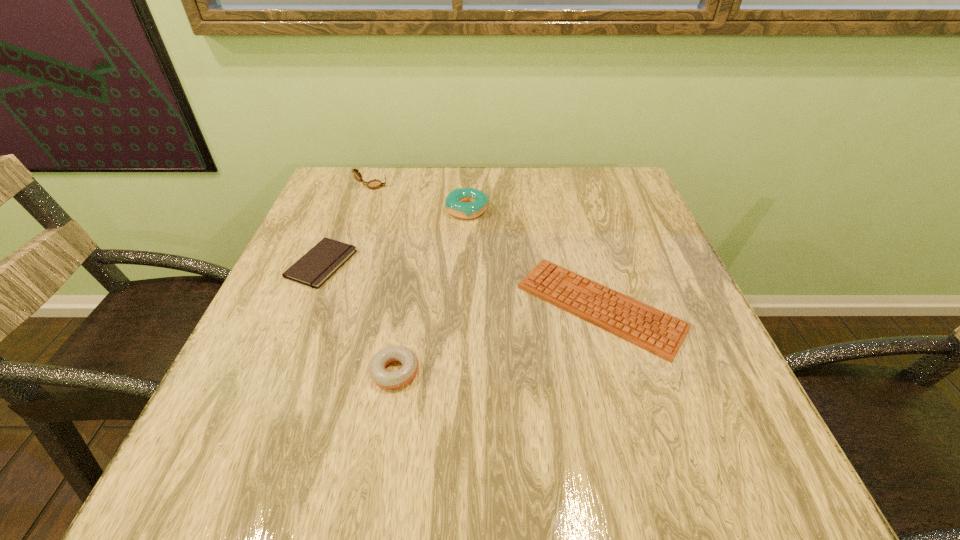
At what (x,y) coordinates should I click in order to perform the action: click on free space at the left edge of the desktop. Please return your answer as a coordinate pair (x, y). The height and width of the screenshot is (540, 960). Looking at the image, I should click on (346, 241).

Locate an element on the screen. free point at the right edge is located at coordinates 745,407.

The image size is (960, 540). What are the coordinates of `free location at the far left corner of the desktop` in the screenshot? It's located at (359, 204).

Identify the location of free space at the near left corner of the desktop. tap(206, 488).

In the image, there is a desktop. Where is `free space at the far right corner`? The width and height of the screenshot is (960, 540). free space at the far right corner is located at coordinates (593, 185).

In the image, there is a desktop. Where is `vacant space at the near right corner`? This screenshot has width=960, height=540. vacant space at the near right corner is located at coordinates 716,478.

Locate an element on the screen. empty location between the checkbook and the shorter doughnut is located at coordinates (358, 318).

Identify the location of empty space that is in between the compass and the checkbook. This screenshot has height=540, width=960. click(x=347, y=225).

Locate an element on the screen. empty space that is in between the rightmost object and the farthest object is located at coordinates (486, 246).

This screenshot has width=960, height=540. Find the location of `free space between the fourth object from left to right and the checkbook`. free space between the fourth object from left to right and the checkbook is located at coordinates (395, 237).